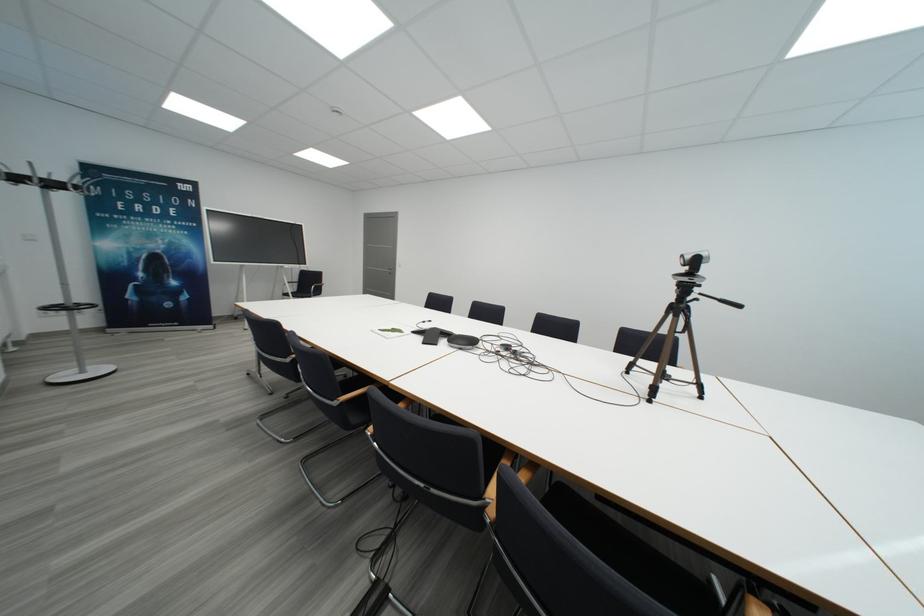
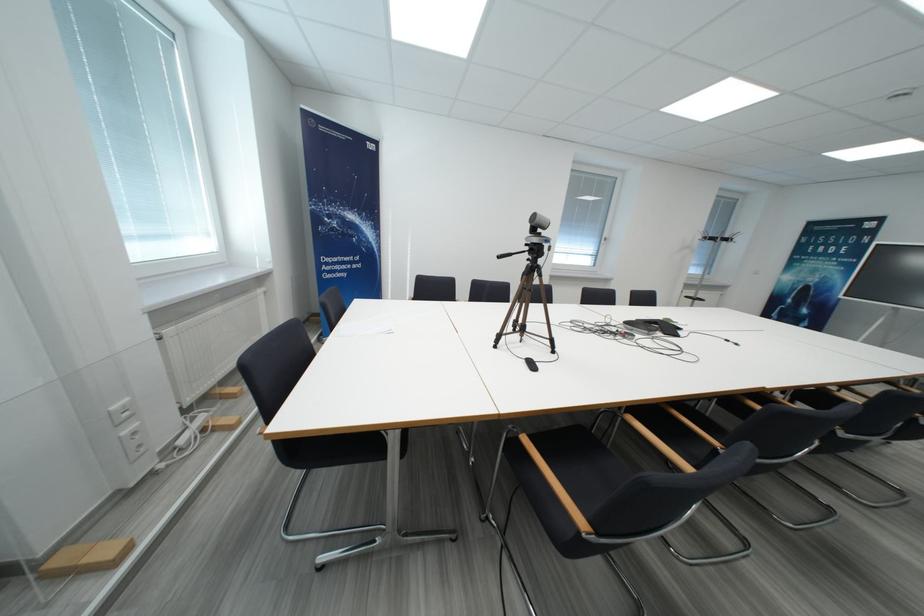
Question: I am providing you with two images of the same scene from different viewpoints. After the viewpoint changes to image2, which objects are now occluded?

Choices:
 (A) camera on tripod
 (B) black chair sitting surface
 (C) wooden block
 (D) folded prayer mat

Answer: (B)